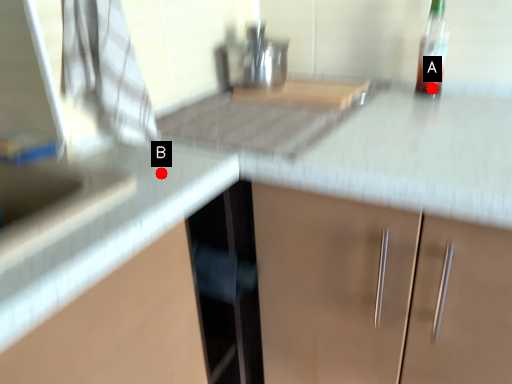
Question: Two points are circled on the image, labeled by A and B beside each circle. Which point is closer to the camera?

Choices:
 (A) A is closer
 (B) B is closer

Answer: (B)